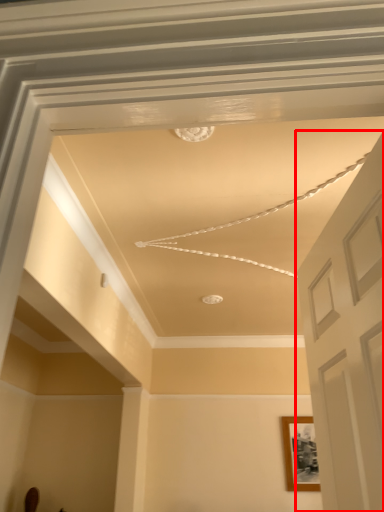
Question: Where is door (annotated by the red box) located in relation to picture frame in the image?

Choices:
 (A) right
 (B) left

Answer: (B)